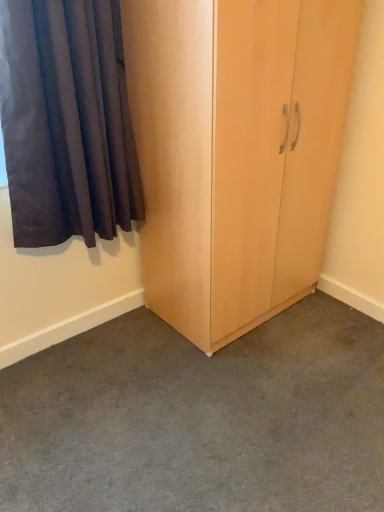
Where is `free location above carpeted floor at center (from a real-world perspective)`? This screenshot has width=384, height=512. free location above carpeted floor at center (from a real-world perspective) is located at coordinates (218, 391).